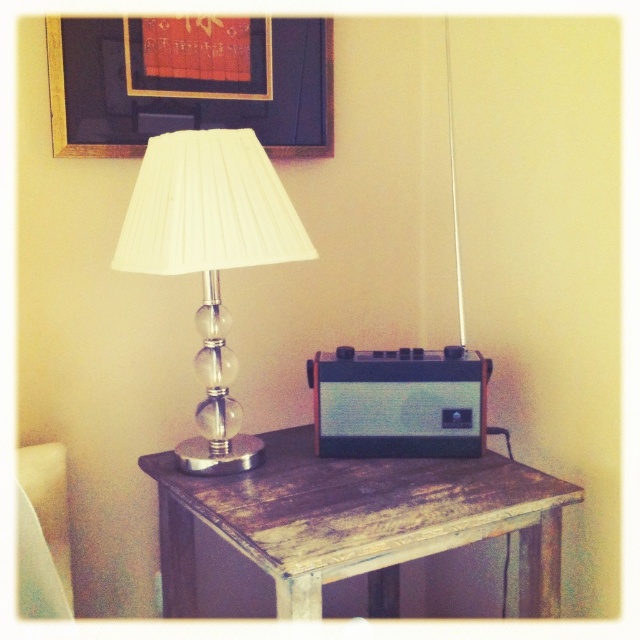
Question: Which point appears closest to the camera in this image?

Choices:
 (A) (316, 513)
 (B) (260, 220)
 (C) (228, 113)

Answer: (A)

Question: Which of these objects is positioned farthest from the distressed wood table at center?

Choices:
 (A) white pleated fabric lampshade at left
 (B) matte gold picture frame at upper center

Answer: (B)

Question: Can you confirm if distressed wood table at center is smaller than white pleated fabric lampshade at left?

Choices:
 (A) yes
 (B) no

Answer: (B)

Question: In this image, where is matte gold picture frame at upper center located relative to white pleated fabric lampshade at left?

Choices:
 (A) above
 (B) below

Answer: (A)

Question: Does distressed wood table at center appear under matte gold picture frame at upper center?

Choices:
 (A) yes
 (B) no

Answer: (A)

Question: Among these objects, which one is farthest from the camera?

Choices:
 (A) distressed wood table at center
 (B) white pleated fabric lampshade at left
 (C) matte gold picture frame at upper center

Answer: (C)